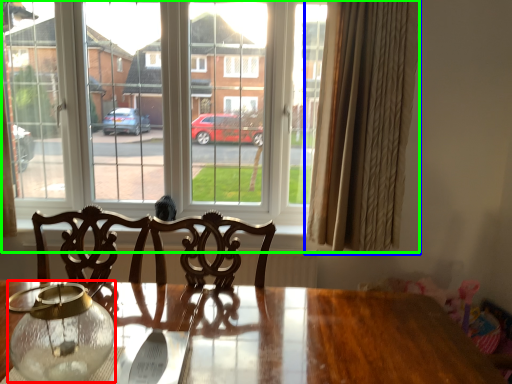
Question: Based on their relative distances, which object is farther from glass vase (highlighted by a red box)? Choose from curtain (highlighted by a blue box) and window (highlighted by a green box).

Choices:
 (A) curtain
 (B) window

Answer: (B)